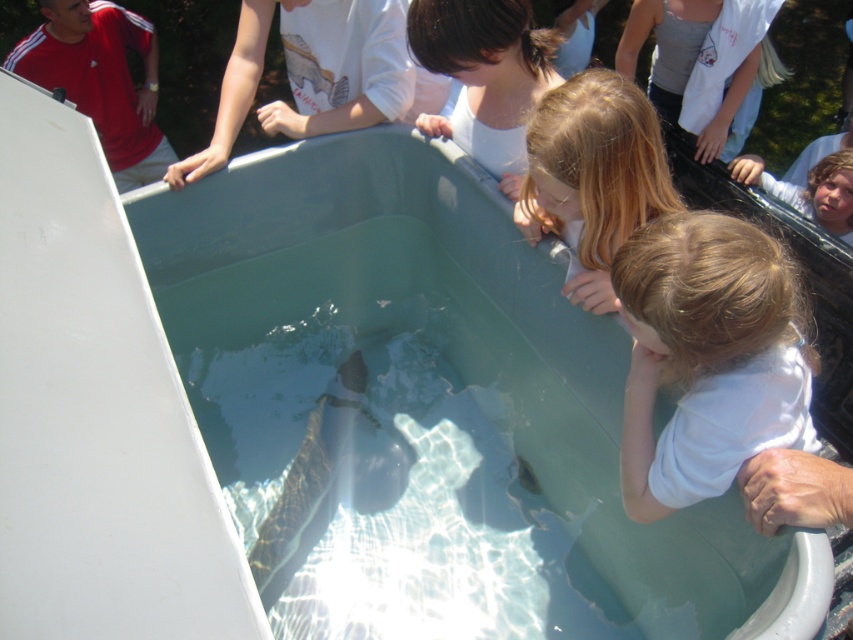
Question: Considering the real-world distances, which object is farthest from the brown hair at upper center?

Choices:
 (A) clear plastic tub at center
 (B) blonde hair at lower center
 (C) light brown hair at lower right

Answer: (C)

Question: Which point is closer to the camera?

Choices:
 (A) blonde hair at lower center
 (B) clear plastic tub at center
 (C) light brown hair at lower right

Answer: (B)

Question: Does clear plastic tub at center have a smaller size compared to brown hair at upper center?

Choices:
 (A) yes
 (B) no

Answer: (B)

Question: Observing the image, what is the correct spatial positioning of light brown hair at lower right in reference to blonde hair at lower center?

Choices:
 (A) below
 (B) above

Answer: (A)

Question: Which point is farther from the camera taking this photo?

Choices:
 (A) (479, 161)
 (B) (738, 612)
 (C) (535, 150)
 (D) (691, 349)

Answer: (A)

Question: Is blonde hair at lower center closer to camera compared to brown hair at upper center?

Choices:
 (A) no
 (B) yes

Answer: (B)